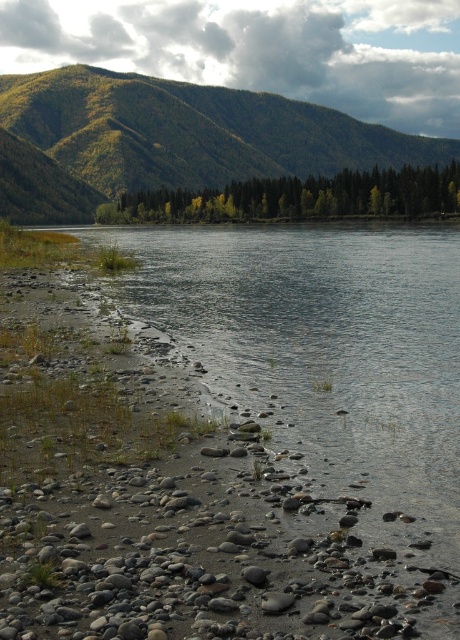
From the picture: You are a hiker who wants to take a photo of the green forested mountain at upper center. Where should you position your camera to capture it in the frame?

The green forested mountain at upper center is located at the 2D coordinates point (x=171, y=140), so position your camera to aim towards that point to capture it in the frame.

You are a hiker standing at the riverbank and want to reach the green forested mountain at upper center. Which direction should you walk from the green matte trees at center?

The green forested mountain at upper center is to the left of green matte trees at center, so you should walk to the left from the green matte trees at center to reach it.

You are standing at the point with coordinates point (177,209) and want to reach the point with coordinates point (56,116). Given that the terrain between them is uneven and rocky, will you have to go over or under any obstacles to reach your destination?

Since point (56,116) is behind point (177,209), you will have to go over the obstacles between them to reach your destination.